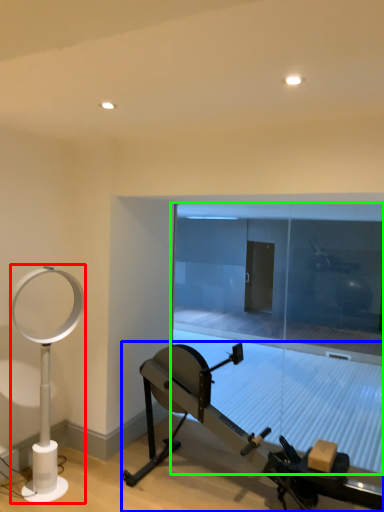
Question: Based on their relative distances, which object is nearer to table lamp (highlighted by a red box)? Choose from stationary bicycle (highlighted by a blue box) and glass door (highlighted by a green box).

Choices:
 (A) stationary bicycle
 (B) glass door

Answer: (A)